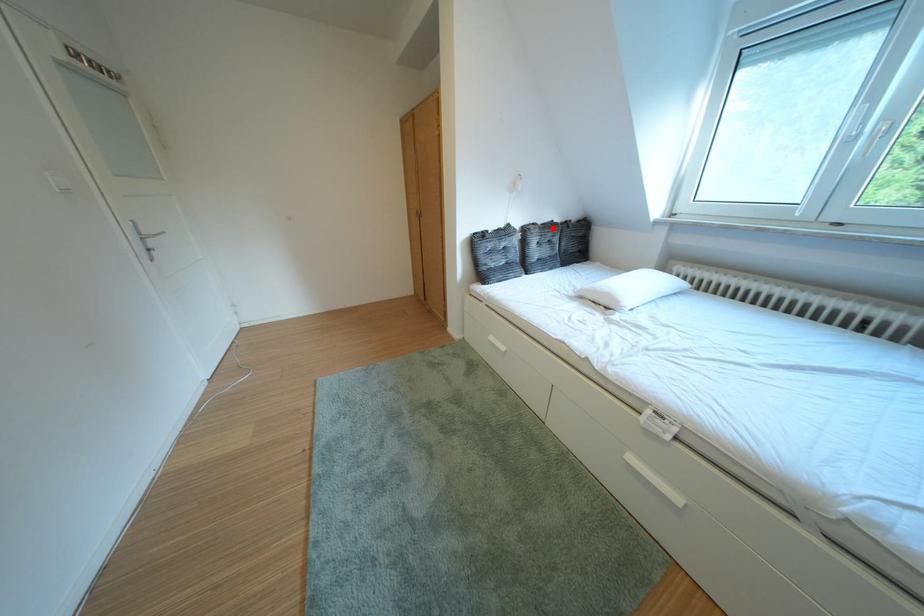
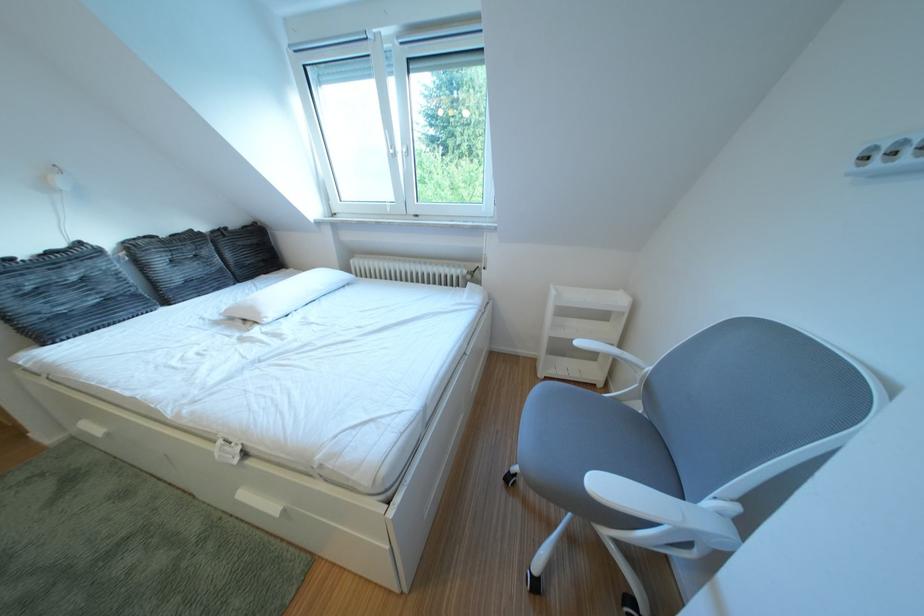
In the second image, find the point that corresponds to the highlighted location in the first image.

(176, 240)